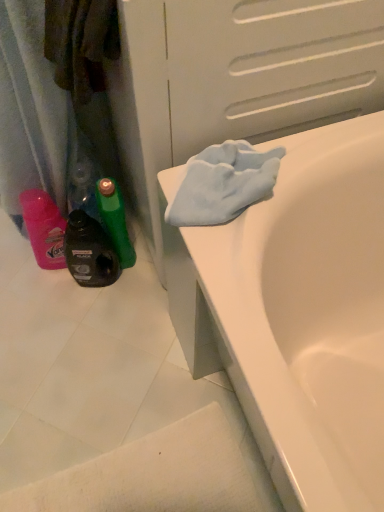
In order to click on free region on the left part of black plastic bottle at lower left in this screenshot , I will do `click(31, 288)`.